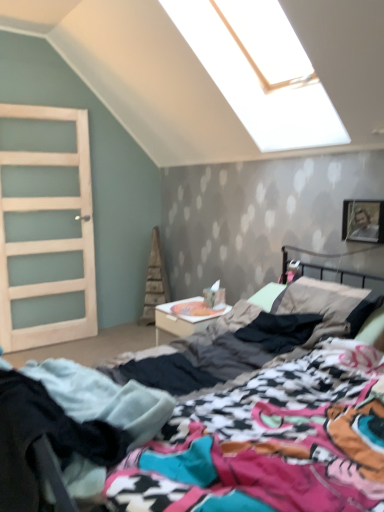
Question: From the image's perspective, is black cotton pants at lower left positioned above or below white glossy nightstand at center?

Choices:
 (A) above
 (B) below

Answer: (B)

Question: In the image, is black cotton pants at lower left positioned in front of or behind white glossy nightstand at center?

Choices:
 (A) front
 (B) behind

Answer: (A)

Question: Considering the real-world distances, which object is closest to the multicolored fabric bed at center?

Choices:
 (A) white glossy nightstand at center
 (B) black cotton pants at lower left
 (C) clear glass door at left
 (D) metallic silver picture frame at upper right

Answer: (B)

Question: Which of these objects is positioned farthest from the metallic silver picture frame at upper right?

Choices:
 (A) black cotton pants at lower left
 (B) white glossy nightstand at center
 (C) multicolored fabric bed at center
 (D) clear glass door at left

Answer: (D)